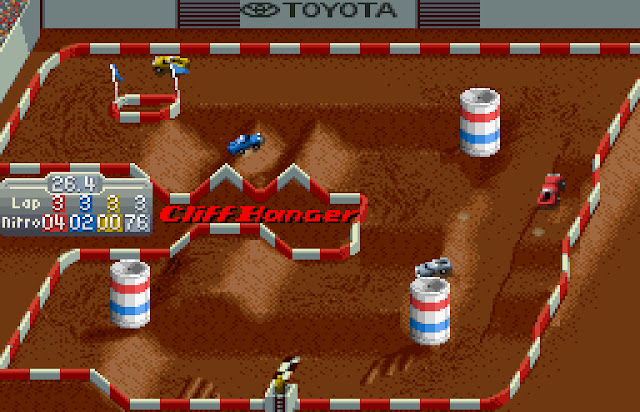
The height and width of the screenshot is (412, 640). I want to click on wall, so click(x=68, y=255), click(x=59, y=61), click(x=67, y=160), click(x=250, y=50), click(x=534, y=47), click(x=609, y=124), click(x=554, y=301).